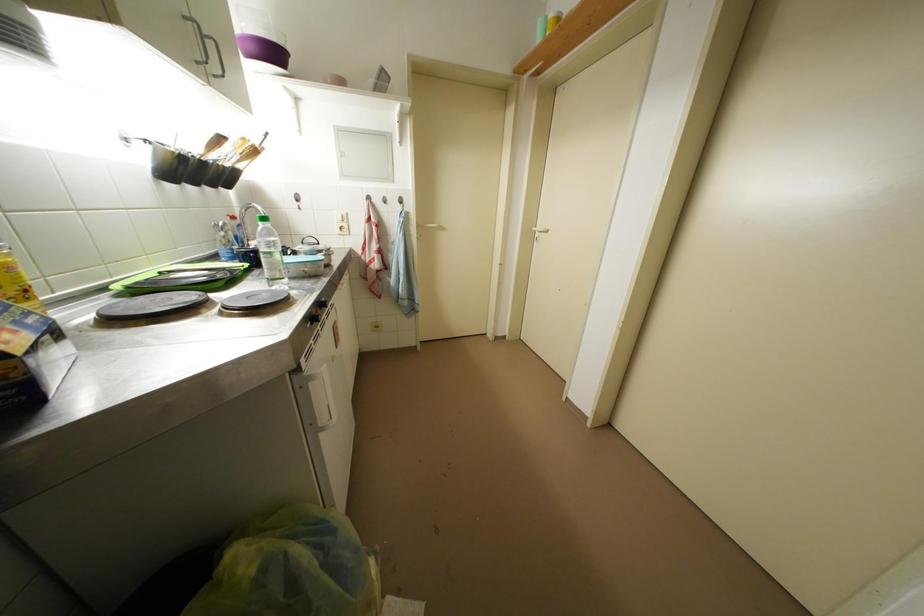
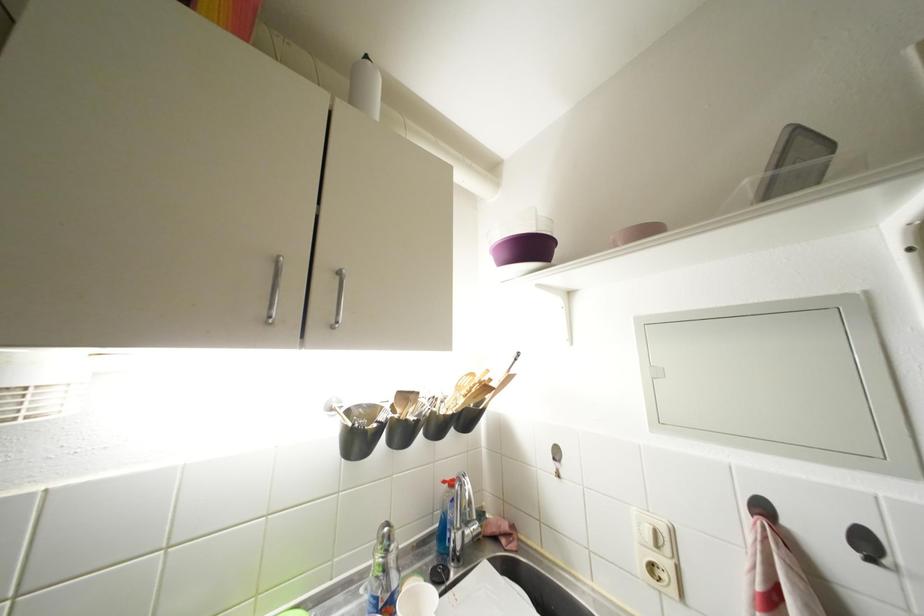
The point at (302, 208) is marked in the first image. Where is the corresponding point in the second image?

(560, 469)